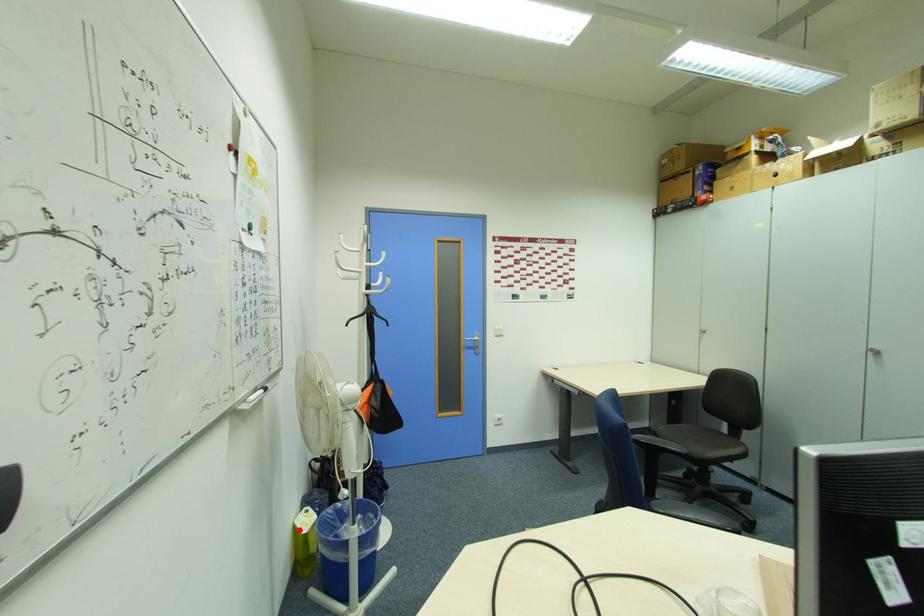
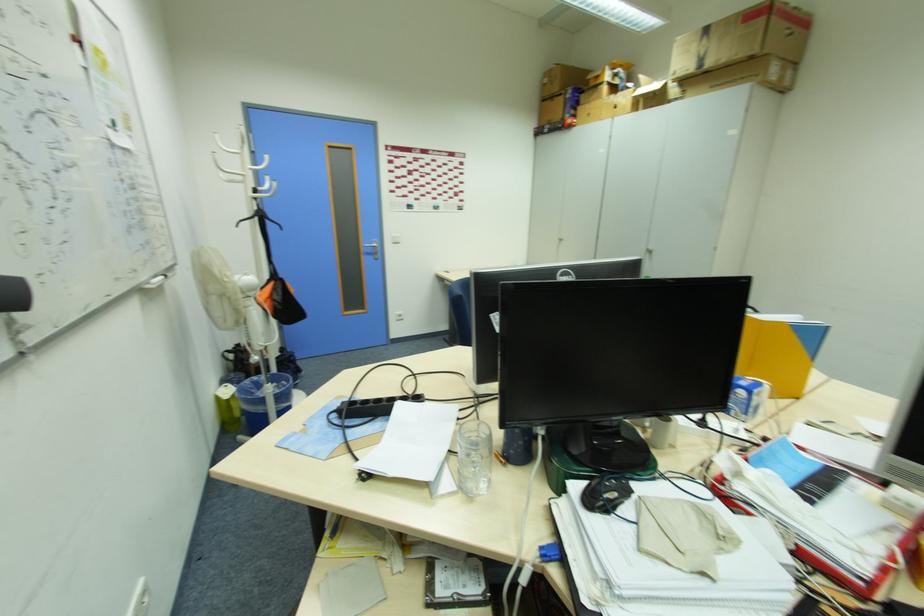
Question: I am providing you with two images of the same scene from different viewpoints. A red point is marked on the first image. Can you still see the location of the red point in image 2?

Choices:
 (A) Yes
 (B) No

Answer: (A)